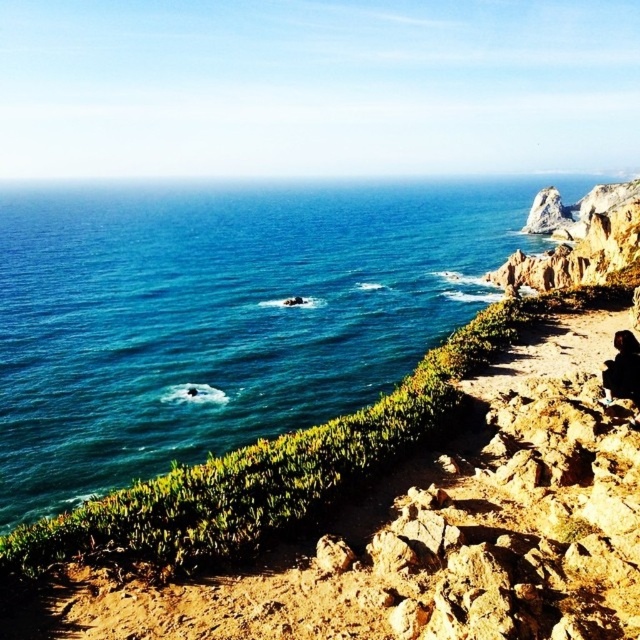
Question: Can you confirm if blue water at upper left is positioned to the left of dark hair at lower right?

Choices:
 (A) no
 (B) yes

Answer: (B)

Question: Considering the relative positions of dark hair at lower right and brown textured rock at center in the image provided, where is dark hair at lower right located with respect to brown textured rock at center?

Choices:
 (A) left
 (B) right

Answer: (B)

Question: Which of these objects is positioned farthest from the brown textured rock at center?

Choices:
 (A) dark hair at lower right
 (B) blue water at upper left

Answer: (B)

Question: Which point is farther to the camera?

Choices:
 (A) (298, 296)
 (B) (616, 390)

Answer: (A)

Question: Which of the following is the farthest from the observer?

Choices:
 (A) dark hair at lower right
 (B) brown textured rock at center
 (C) blue water at upper left

Answer: (B)

Question: Is blue water at upper left to the left of dark hair at lower right from the viewer's perspective?

Choices:
 (A) no
 (B) yes

Answer: (B)